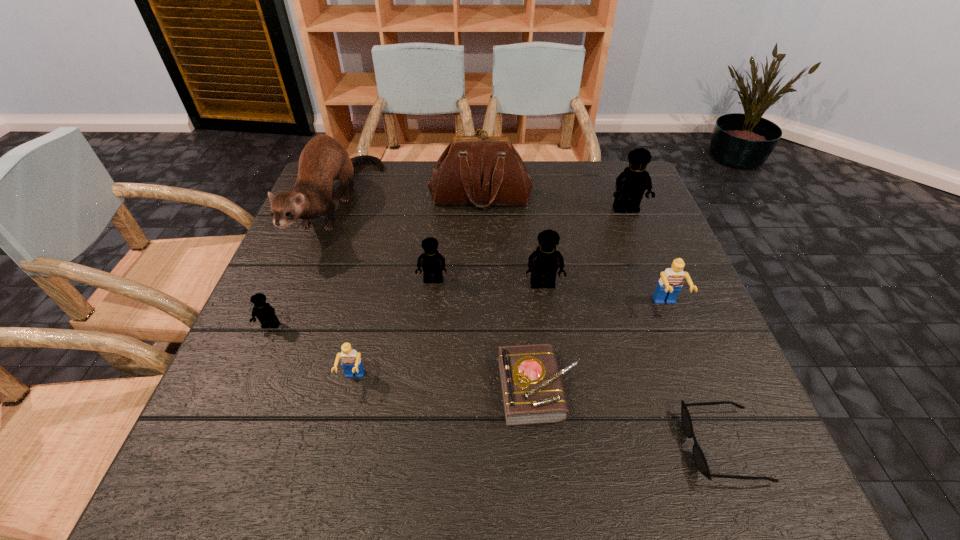
Locate an element on the screen. brown shoulder bag is located at coordinates (483, 170).

This screenshot has width=960, height=540. Identify the location of ferret. (323, 159).

Image resolution: width=960 pixels, height=540 pixels. In order to click on the tallest Lego in this screenshot , I will do `click(631, 184)`.

Locate an element on the screen. the rightmost yellow Lego is located at coordinates pos(631,184).

Image resolution: width=960 pixels, height=540 pixels. Find the location of `the second tallest Lego`. the second tallest Lego is located at coordinates (543, 263).

At what (x,y) coordinates should I click in order to perform the action: click on the second biggest yellow Lego. Please return your answer as a coordinate pair (x, y). Looking at the image, I should click on (543, 263).

At what (x,y) coordinates should I click in order to perform the action: click on the third Lego from left to right. Please return your answer as a coordinate pair (x, y). The image size is (960, 540). Looking at the image, I should click on (432, 263).

Find the location of a particular element. The height and width of the screenshot is (540, 960). the second yellow Lego from left to right is located at coordinates (432, 263).

The image size is (960, 540). Identify the location of the sixth farthest object. (669, 285).

At what (x,y) coordinates should I click in order to perform the action: click on the farther blue Lego. Please return your answer as a coordinate pair (x, y). Looking at the image, I should click on (669, 285).